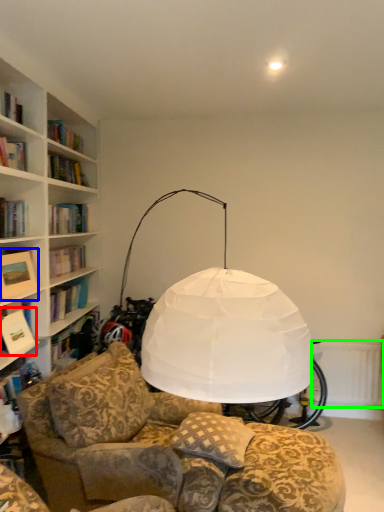
Question: Based on their relative distances, which object is farther from book (highlighted by a red box)? Choose from picture frame (highlighted by a blue box) and radiator (highlighted by a green box).

Choices:
 (A) picture frame
 (B) radiator

Answer: (B)